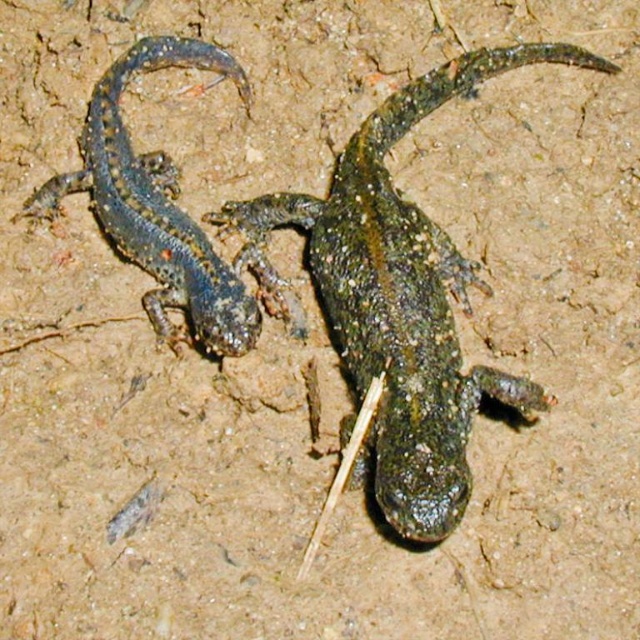
Question: Which point is farther to the camera?

Choices:
 (A) (394, 202)
 (B) (195, 253)

Answer: (A)

Question: Can you confirm if green scaly lizard at center is thinner than shiny blue lizard at left?

Choices:
 (A) no
 (B) yes

Answer: (A)

Question: Can you confirm if green scaly lizard at center is positioned above shiny blue lizard at left?

Choices:
 (A) yes
 (B) no

Answer: (B)

Question: Among these points, which one is nearest to the camera?

Choices:
 (A) (429, 333)
 (B) (221, 316)

Answer: (A)

Question: Can you confirm if green scaly lizard at center is positioned to the left of shiny blue lizard at left?

Choices:
 (A) no
 (B) yes

Answer: (A)